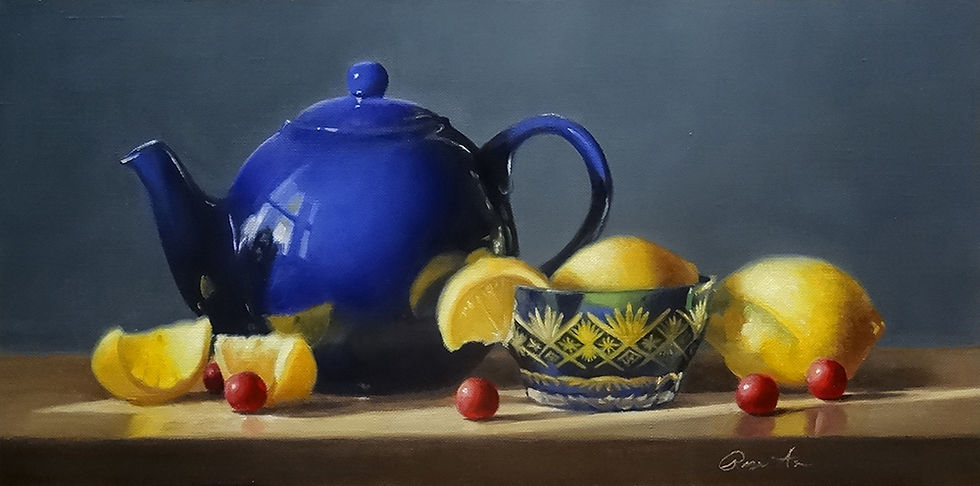
You are a GUI agent. You are given a task and a screenshot of the screen. Output one action in this format:
    pyautogui.click(x=<x>, y=<y>)
    Task: Click on the red grapes on top of table
    
    Given the screenshot: What is the action you would take?
    pyautogui.click(x=819, y=380), pyautogui.click(x=767, y=394), pyautogui.click(x=479, y=397), pyautogui.click(x=248, y=389), pyautogui.click(x=214, y=377)